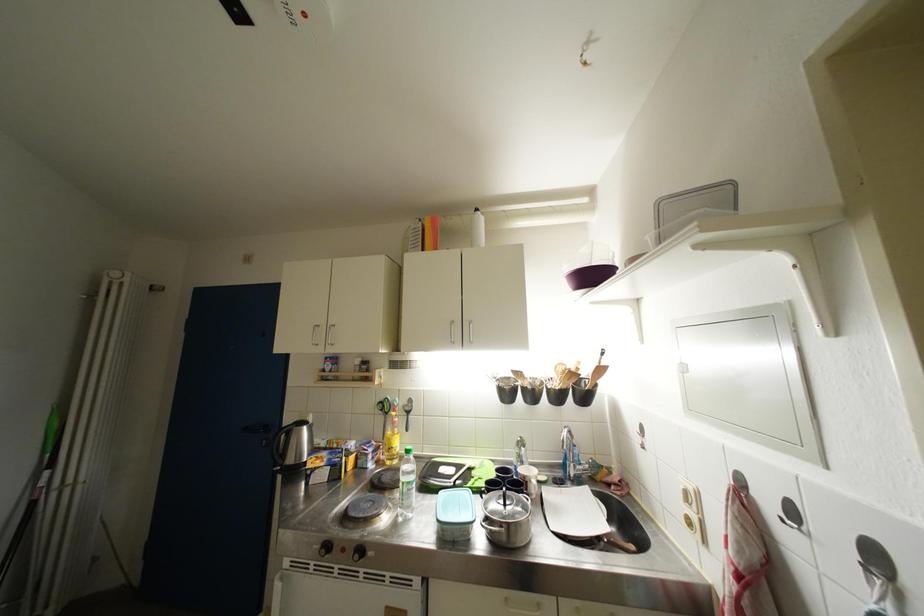
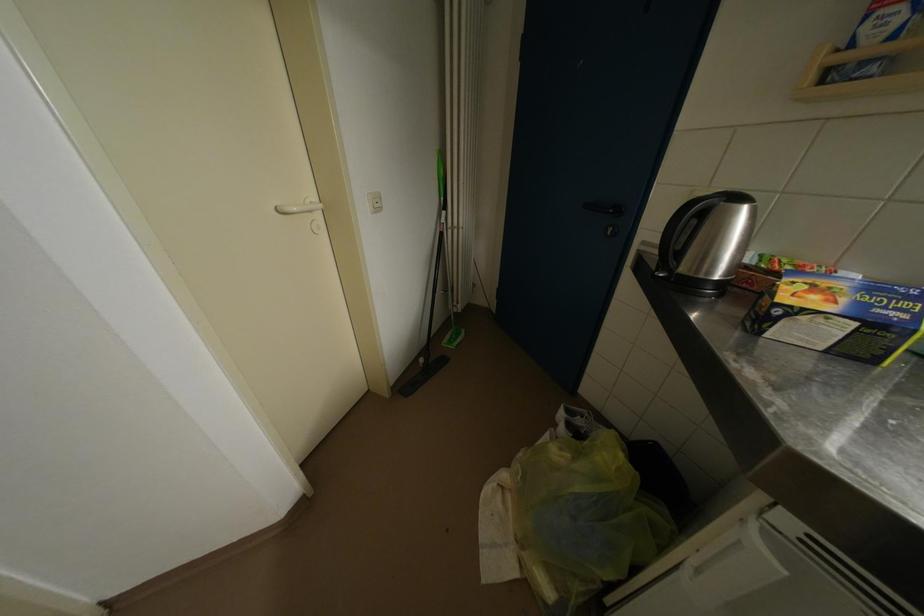
First-person continuous shooting, in which direction is the camera rotating?

The camera's rotation is toward left-down.